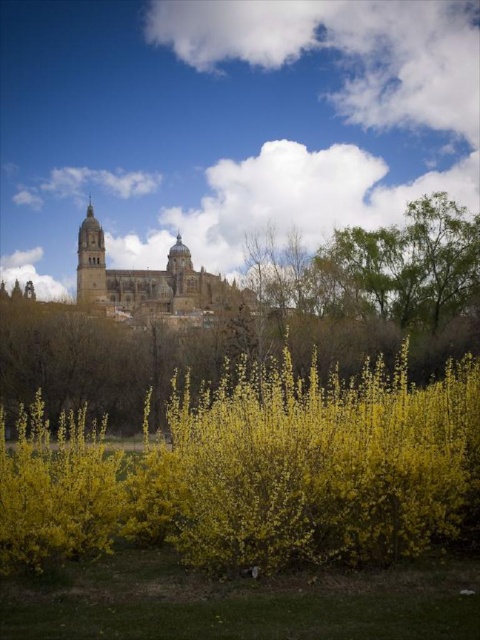
You are standing at the base of the hill looking towards the cathedral. There are two points marked in the scene. The first point is at coordinates point [121,276] and the second is at point [79,248]. Which point is closer to you?

Point [79,248] is closer to you because it is in front of point [121,276].